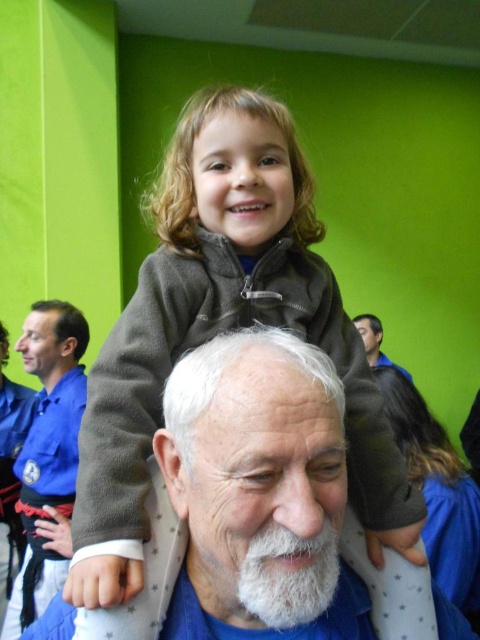
Question: Which point is farther to the camera?

Choices:
 (A) (396, 410)
 (B) (15, 346)
 (C) (354, 321)
 (D) (226, 157)

Answer: (C)

Question: Is matte gray jacket at center to the right of dark brown fleece jacket at upper center from the viewer's perspective?

Choices:
 (A) yes
 (B) no

Answer: (B)

Question: Which object appears farthest from the camera in this image?

Choices:
 (A) dark blue shirt at upper right
 (B) matte gray jacket at center
 (C) blue fabric shirt at left

Answer: (A)

Question: Does white fluffy beard at center appear under dark blue shirt at upper right?

Choices:
 (A) yes
 (B) no

Answer: (A)

Question: Is white fluffy beard at center bigger than dark blue shirt at upper right?

Choices:
 (A) yes
 (B) no

Answer: (B)

Question: Among these points, which one is farthest from the camera?

Choices:
 (A) (379, 342)
 (B) (11, 618)

Answer: (A)